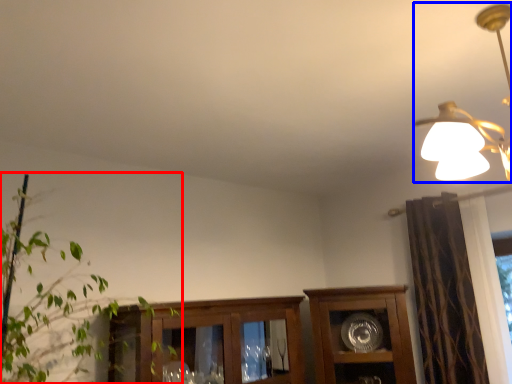
Question: Which object appears closest to the camera in this image, houseplant (highlighted by a red box) or lamp (highlighted by a blue box)?

Choices:
 (A) houseplant
 (B) lamp

Answer: (B)